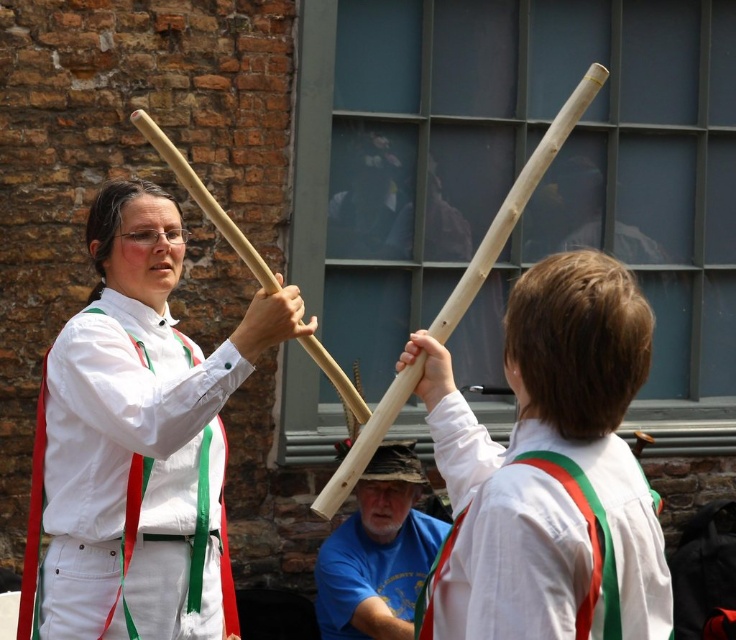
Question: Considering the relative positions of matte wood stick at center and white cotton shirt at upper right in the image provided, where is matte wood stick at center located with respect to white cotton shirt at upper right?

Choices:
 (A) below
 (B) above

Answer: (B)

Question: In this image, where is white cotton shirt at upper right located relative to blue t-shirt at center?

Choices:
 (A) above
 (B) below

Answer: (A)

Question: Which point is farther to the camera?

Choices:
 (A) (595, 609)
 (B) (272, 305)

Answer: (B)

Question: Among these objects, which one is nearest to the camera?

Choices:
 (A) white cotton shirt at upper right
 (B) blue t-shirt at center

Answer: (A)

Question: Which point is closer to the camera taking this photo?

Choices:
 (A) (541, 579)
 (B) (364, 586)

Answer: (A)

Question: Does matte wood stick at center have a greater width compared to blue t-shirt at center?

Choices:
 (A) yes
 (B) no

Answer: (A)